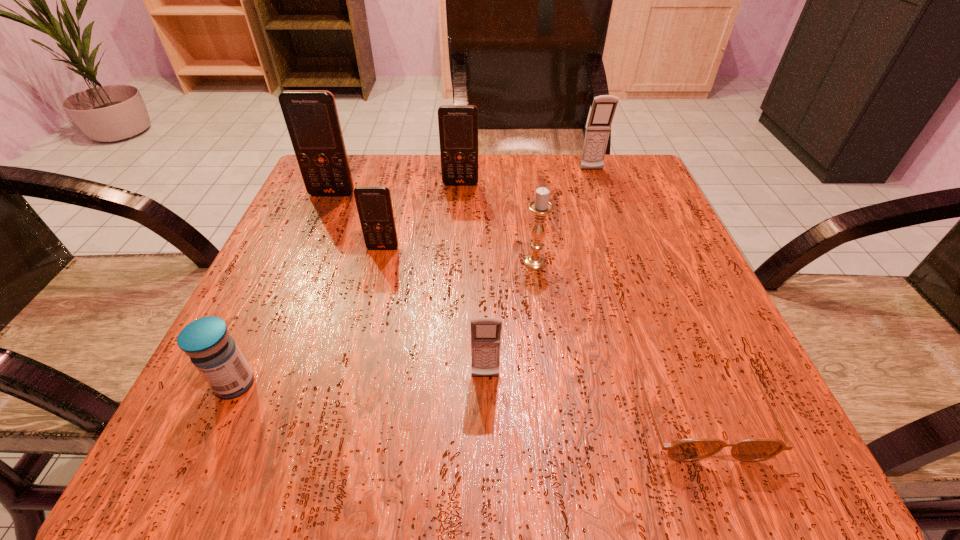
Locate an element on the screen. the smaller gray cellular telephone is located at coordinates (485, 332).

Locate an element on the screen. the left gray cellular telephone is located at coordinates (485, 332).

Image resolution: width=960 pixels, height=540 pixels. What are the coordinates of `blue medicine` in the screenshot? It's located at (214, 353).

You are a GUI agent. You are given a task and a screenshot of the screen. Output one action in this format:
    pyautogui.click(x=<x>, y=<y>)
    Task: Click on the medicine
    This screenshot has width=960, height=540.
    Given the screenshot: What is the action you would take?
    pyautogui.click(x=214, y=353)

The width and height of the screenshot is (960, 540). Identify the location of the shortest object. (757, 449).

I want to click on sunglasses, so click(757, 449).

Locate an element on the screen. vacant region located 0.260m on the screen of the leftmost cellular telephone is located at coordinates (295, 282).

Image resolution: width=960 pixels, height=540 pixels. Find the location of `free space located 0.200m on the front-facing side of the farther gray cellular telephone`. free space located 0.200m on the front-facing side of the farther gray cellular telephone is located at coordinates (611, 225).

Where is `free space located 0.270m on the screen of the second farthest object`? Image resolution: width=960 pixels, height=540 pixels. free space located 0.270m on the screen of the second farthest object is located at coordinates (456, 269).

At what (x,y) coordinates should I click in order to perform the action: click on free space located on the right of the fifth farthest object. Please return your answer as a coordinate pair (x, y). Looking at the image, I should click on (601, 262).